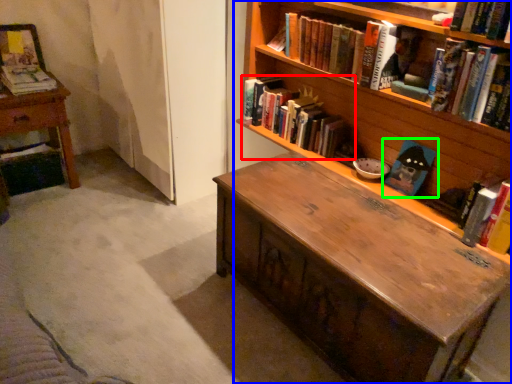
Question: Which object is the closest to the book (highlighted by a red box)? Choose among these: bookcase (highlighted by a blue box) or book (highlighted by a green box).

Choices:
 (A) bookcase
 (B) book

Answer: (A)